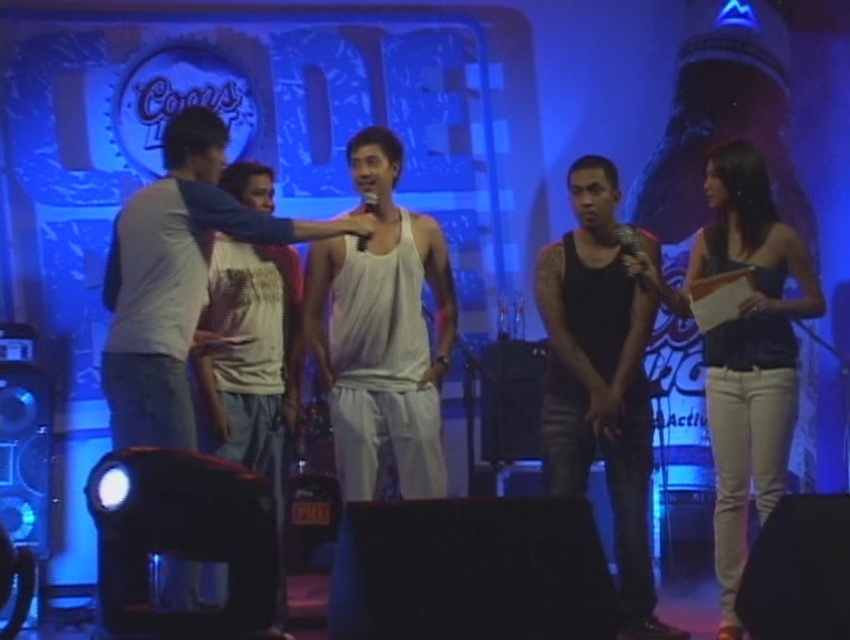
Question: Is white cotton t-shirt at center closer to camera compared to matte black microphone at center?

Choices:
 (A) no
 (B) yes

Answer: (A)

Question: Based on their relative distances, which object is nearer to the white cotton t-shirt at center?

Choices:
 (A) white matte tank top at center
 (B) black matte tank top at center
 (C) white cotton tank top at center
 (D) matte black tank top at right

Answer: (A)

Question: Does white cotton tank top at center have a larger size compared to matte black microphone at center?

Choices:
 (A) no
 (B) yes

Answer: (B)

Question: Is black matte tank top at center below white cotton t-shirt at center?

Choices:
 (A) no
 (B) yes

Answer: (B)

Question: Which point is farther to the camera?

Choices:
 (A) (408, 355)
 (B) (363, 204)

Answer: (B)

Question: Which object is positioned farthest from the white cotton t-shirt at center?

Choices:
 (A) matte black tank top at right
 (B) white cotton tank top at center

Answer: (A)